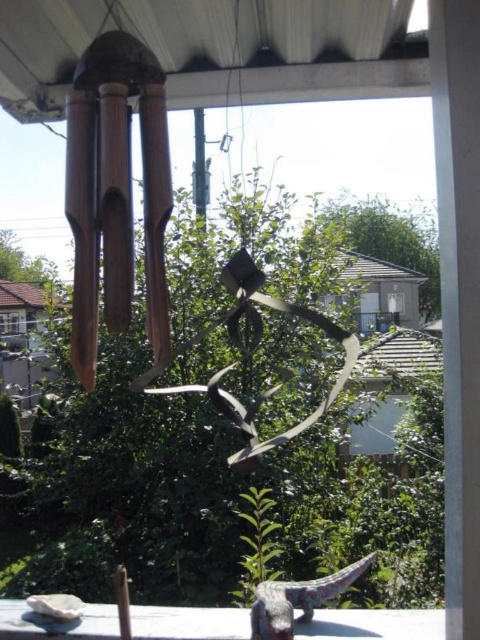
Question: Which point appears closest to the camera in this image?

Choices:
 (A) (382, 614)
 (B) (252, 620)
 (C) (339, 371)

Answer: (B)

Question: Does white stone table at lower center appear under multicolored plastic lizard at lower center?

Choices:
 (A) no
 (B) yes

Answer: (B)

Question: Which point is closer to the camera?

Choices:
 (A) metallic silver star at center
 (B) white stone table at lower center
 (C) multicolored plastic lizard at lower center

Answer: (A)

Question: Does white stone table at lower center have a lesser width compared to metallic silver star at center?

Choices:
 (A) yes
 (B) no

Answer: (B)

Question: Is metallic silver star at center positioned before multicolored plastic lizard at lower center?

Choices:
 (A) no
 (B) yes

Answer: (B)

Question: Which is farther from the multicolored plastic lizard at lower center?

Choices:
 (A) metallic silver star at center
 (B) white stone table at lower center

Answer: (A)